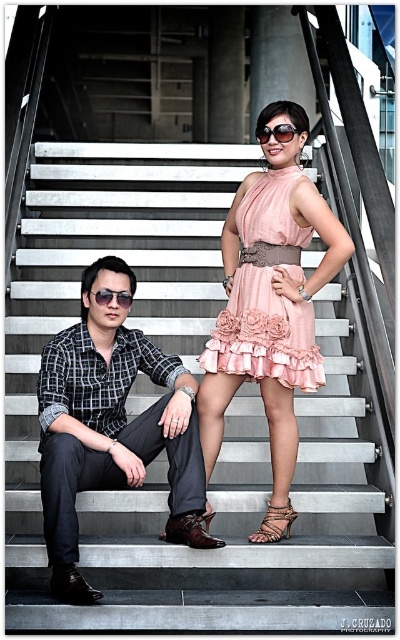
Between brown leather sandal at lower center and sunglasses at center, which one appears on the left side from the viewer's perspective?

brown leather sandal at lower center

Based on the photo, is brown leather sandal at lower center to the right of sunglasses at center from the viewer's perspective?

In fact, brown leather sandal at lower center is to the left of sunglasses at center.

Which is behind, point (214, 536) or point (264, 141)?

The point (214, 536) is more distant.

In order to click on brown leather sandal at lower center in this screenshot , I will do `click(190, 531)`.

Is checkered fabric shirt at left shorter than brown leather sandal at lower center?

In fact, checkered fabric shirt at left may be taller than brown leather sandal at lower center.

Between point (170, 406) and point (168, 524), which one is positioned behind?

Positioned behind is point (168, 524).

I want to click on checkered fabric shirt at left, so click(108, 420).

Between point (298, 349) and point (254, 541), which one is positioned in front?

Point (298, 349) is in front.

Based on the photo, who is positioned more to the right, pink satin dress at center or brown leather sandal at center?

From the viewer's perspective, brown leather sandal at center appears more on the right side.

Between point (286, 234) and point (289, 525), which one is positioned in front?

Point (286, 234) is in front.

Locate an element on the screen. The width and height of the screenshot is (400, 640). pink satin dress at center is located at coordinates (264, 333).